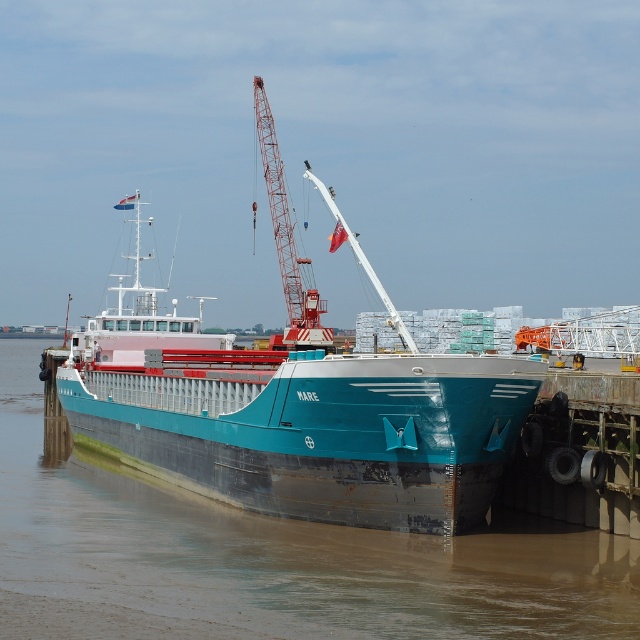
Measure the distance between point (161,474) and camera.

A distance of 46.06 meters exists between point (161,474) and camera.

Is teal matte barge at center thinner than red metallic crane at center?

No, teal matte barge at center is not thinner than red metallic crane at center.

Who is more distant from viewer, (432, 515) or (276, 246)?

The point (276, 246) is behind.

Where is `teal matte barge at center`? This screenshot has width=640, height=640. teal matte barge at center is located at coordinates (298, 419).

Where is `teal metallic water at lower left`? The image size is (640, 640). teal metallic water at lower left is located at coordinates (268, 557).

Image resolution: width=640 pixels, height=640 pixels. What are the coordinates of `teal metallic water at lower left` in the screenshot? It's located at (268, 557).

Can you confirm if teal metallic water at lower left is taller than teal matte barge at center?

No, teal metallic water at lower left is not taller than teal matte barge at center.

Is teal metallic water at lower left closer to camera compared to teal matte barge at center?

Yes.

Is point (589, 618) farther from viewer compared to point (401, 492)?

No, (589, 618) is closer to viewer.

You are a GUI agent. You are given a task and a screenshot of the screen. Output one action in this format:
    pyautogui.click(x=<x>, y=<y>)
    Task: Click on the teal metallic water at lower left
    The width and height of the screenshot is (640, 640).
    Given the screenshot: What is the action you would take?
    pyautogui.click(x=268, y=557)